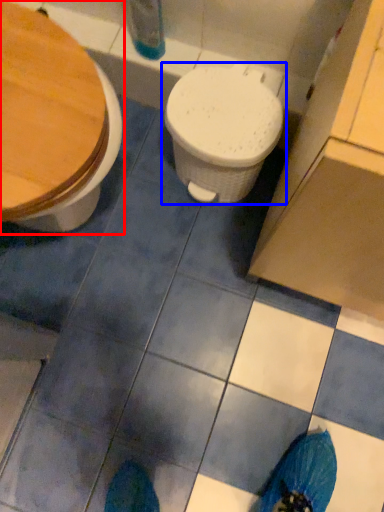
Question: Among these objects, which one is nearest to the camera, toilet (highlighted by a red box) or toilet (highlighted by a blue box)?

Choices:
 (A) toilet
 (B) toilet

Answer: (A)